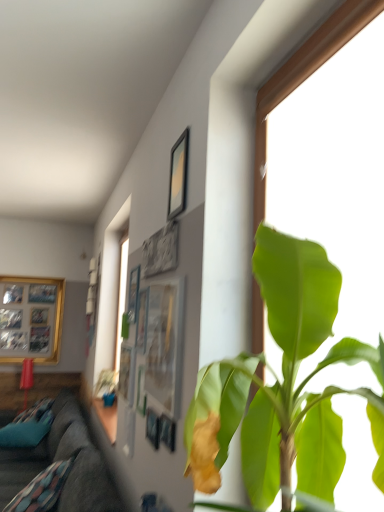
Measure the distance between point (26, 483) and camera.

Point (26, 483) and camera are 3.16 meters apart from each other.

Find the location of a particular element. dark gray fabric couch at lower left is located at coordinates (68, 458).

This screenshot has height=512, width=384. Identify the location of matte glass picture frame at center, marked as the 5th picture frame in a back-to-front arrangement. pyautogui.click(x=165, y=343).

The height and width of the screenshot is (512, 384). Find the location of `dark gray fabric couch at lower left`. dark gray fabric couch at lower left is located at coordinates (68, 458).

Does green leafy plant at center have a lesser height compared to metallic silver picture frame at upper center, which is counted as the 4th picture frame, starting from the right?

No, green leafy plant at center is not shorter than metallic silver picture frame at upper center, which is counted as the 4th picture frame, starting from the right.

Measure the distance from green leafy plant at center to metallic silver picture frame at upper center, which is the 2th picture frame in left-to-right order.

green leafy plant at center is 1.53 meters away from metallic silver picture frame at upper center, which is the 2th picture frame in left-to-right order.

From the image's perspective, which is below, green leafy plant at center or metallic silver picture frame at upper center, which is the 2th picture frame in left-to-right order?

metallic silver picture frame at upper center, which is the 2th picture frame in left-to-right order.

Is metallic silver picture frame at upper center, which is the 2th picture frame in left-to-right order, completely or partially inside green leafy plant at center?

No, metallic silver picture frame at upper center, which is the 2th picture frame in left-to-right order, is not inside green leafy plant at center.

Is matte black picture frame at upper center, which is counted as the fifth picture frame, starting from the left, bigger or smaller than dark gray fabric couch at lower left?

In the image, matte black picture frame at upper center, which is counted as the fifth picture frame, starting from the left, appears to be smaller than dark gray fabric couch at lower left.

From a real-world perspective, is matte black picture frame at upper center, marked as the fourth picture frame in a back-to-front arrangement, below dark gray fabric couch at lower left?

No.

Which object is thinner, matte black picture frame at upper center, which is counted as the second picture frame, starting from the front, or dark gray fabric couch at lower left?

Thinner between the two is matte black picture frame at upper center, which is counted as the second picture frame, starting from the front.

Which is closer to the camera, (178, 186) or (2, 465)?

Point (178, 186) appears to be closer to the viewer than point (2, 465).

In order to click on studio couch on the right of wooden photo frame at left, which is the 1th picture frame in back-to-front order in this screenshot , I will do `click(68, 458)`.

Does point (67, 392) lie behind point (42, 358)?

No, (67, 392) is in front of (42, 358).

Is dark gray fabric couch at lower left directly adjacent to wooden photo frame at left, the 1th picture frame viewed from the left?

dark gray fabric couch at lower left and wooden photo frame at left, the 1th picture frame viewed from the left, are not in contact.

Which is more to the left, matte black picture frame at upper center, which is counted as the second picture frame, starting from the front, or metallic silver picture frame at upper center, which is counted as the 4th picture frame, starting from the right?

metallic silver picture frame at upper center, which is counted as the 4th picture frame, starting from the right.

At what (x,y) coordinates should I click in order to perform the action: click on picture frame that is the 3rd object to the left of the matte black picture frame at upper center, which is counted as the fifth picture frame, starting from the left, starting at the anchor. Please return your answer as a coordinate pair (x, y). Image resolution: width=384 pixels, height=512 pixels. Looking at the image, I should click on (133, 293).

Is matte black picture frame at upper center, which is counted as the fifth picture frame, starting from the left, oriented away from metallic silver picture frame at upper center, which is counted as the 2th picture frame, starting from the back?

No, metallic silver picture frame at upper center, which is counted as the 2th picture frame, starting from the back, is not at the back of matte black picture frame at upper center, which is counted as the fifth picture frame, starting from the left.

Is metallic silver picture frame at upper center, which is counted as the 2th picture frame, starting from the back, inside or outside of matte glass picture frame at center, marked as the 5th picture frame in a back-to-front arrangement?

metallic silver picture frame at upper center, which is counted as the 2th picture frame, starting from the back, is not enclosed by matte glass picture frame at center, marked as the 5th picture frame in a back-to-front arrangement.

Considering the relative sizes of metallic silver picture frame at upper center, which is the 2th picture frame in left-to-right order, and matte glass picture frame at center, the fourth picture frame when ordered from left to right, in the image provided, is metallic silver picture frame at upper center, which is the 2th picture frame in left-to-right order, smaller than matte glass picture frame at center, the fourth picture frame when ordered from left to right,?

Correct, metallic silver picture frame at upper center, which is the 2th picture frame in left-to-right order, occupies less space than matte glass picture frame at center, the fourth picture frame when ordered from left to right.

From the picture: Is metallic silver picture frame at upper center, which is counted as the fourth picture frame, starting from the front, wider or thinner than matte glass picture frame at center, the fourth picture frame when ordered from left to right?

In the image, metallic silver picture frame at upper center, which is counted as the fourth picture frame, starting from the front, appears to be more narrow than matte glass picture frame at center, the fourth picture frame when ordered from left to right.

Is metallic silver picture frame at upper center, which is counted as the 4th picture frame, starting from the right, positioned far away from matte glass picture frame at center, the fourth picture frame when ordered from left to right?

No, metallic silver picture frame at upper center, which is counted as the 4th picture frame, starting from the right, is not far from matte glass picture frame at center, the fourth picture frame when ordered from left to right.

Which of these two, wooden photo frame at left, which ranks as the fifth picture frame in right-to-left order, or matte glass picture frame at center, marked as the 5th picture frame in a back-to-front arrangement, is wider?

wooden photo frame at left, which ranks as the fifth picture frame in right-to-left order, is wider.

From the image's perspective, is wooden photo frame at left, which ranks as the fifth picture frame in right-to-left order, located beneath matte glass picture frame at center, positioned as the 1th picture frame in front-to-back order?

Yes, from the image's perspective, wooden photo frame at left, which ranks as the fifth picture frame in right-to-left order, is below matte glass picture frame at center, positioned as the 1th picture frame in front-to-back order.

Does wooden photo frame at left, which ranks as the fifth picture frame in right-to-left order, have a smaller size compared to matte glass picture frame at center, the 2th picture frame from the right?

Actually, wooden photo frame at left, which ranks as the fifth picture frame in right-to-left order, might be larger than matte glass picture frame at center, the 2th picture frame from the right.

Considering the positions of point (0, 282) and point (164, 345), is point (0, 282) closer or farther from the camera than point (164, 345)?

Point (0, 282) is farther from the camera than point (164, 345).

Is matte black picture frame at upper center, which ranks as the 3th picture frame in front-to-back order, smaller than wooden photo frame at left, which is the 1th picture frame in back-to-front order?

Yes, matte black picture frame at upper center, which ranks as the 3th picture frame in front-to-back order, is smaller than wooden photo frame at left, which is the 1th picture frame in back-to-front order.

Is matte black picture frame at upper center, acting as the third picture frame starting from the right, with wooden photo frame at left, which is the 1th picture frame in back-to-front order?

matte black picture frame at upper center, acting as the third picture frame starting from the right, is not next to wooden photo frame at left, which is the 1th picture frame in back-to-front order, and they're not touching.

From a real-world perspective, is matte black picture frame at upper center, which appears as the third picture frame when viewed from the back, located higher than wooden photo frame at left, which is the 1th picture frame in back-to-front order?

Indeed, from a real-world perspective, matte black picture frame at upper center, which appears as the third picture frame when viewed from the back, stands above wooden photo frame at left, which is the 1th picture frame in back-to-front order.

Could you measure the distance between matte black picture frame at upper center, which appears as the third picture frame when viewed from the back, and wooden photo frame at left, which appears as the 5th picture frame when viewed from the front?

matte black picture frame at upper center, which appears as the third picture frame when viewed from the back, and wooden photo frame at left, which appears as the 5th picture frame when viewed from the front, are 3.80 meters apart from each other.

From the image's perspective, count 1st picture frames downward from the green leafy plant at center and point to it. Please provide its 2D coordinates.

[(133, 293)]

Find the location of `studio couch behind the matte black picture frame at upper center, which is counted as the fifth picture frame, starting from the left`. studio couch behind the matte black picture frame at upper center, which is counted as the fifth picture frame, starting from the left is located at coordinates (68, 458).

Looking at the image, which one is located closer to metallic silver picture frame at upper center, which is counted as the 4th picture frame, starting from the right, wooden photo frame at left, the 1th picture frame viewed from the left, or green leafy plant at center?

Among the two, green leafy plant at center is located nearer to metallic silver picture frame at upper center, which is counted as the 4th picture frame, starting from the right.

When comparing their distances from dark gray fabric couch at lower left, does matte black picture frame at upper center, which appears as the third picture frame when viewed from the back, or wooden photo frame at left, which appears as the 5th picture frame when viewed from the front, seem further?

Among the two, wooden photo frame at left, which appears as the 5th picture frame when viewed from the front, is located further to dark gray fabric couch at lower left.

Which object lies further to the anchor point matte glass picture frame at center, marked as the 5th picture frame in a back-to-front arrangement, matte black picture frame at upper center, which ranks as the 3th picture frame in front-to-back order, or metallic silver picture frame at upper center, which is counted as the fourth picture frame, starting from the front?

metallic silver picture frame at upper center, which is counted as the fourth picture frame, starting from the front, is positioned further to the anchor matte glass picture frame at center, marked as the 5th picture frame in a back-to-front arrangement.

Which object lies nearer to the anchor point wooden photo frame at left, which ranks as the fifth picture frame in right-to-left order, metallic silver picture frame at upper center, which is counted as the 2th picture frame, starting from the back, or green leafy plant at center?

Among the two, metallic silver picture frame at upper center, which is counted as the 2th picture frame, starting from the back, is located nearer to wooden photo frame at left, which ranks as the fifth picture frame in right-to-left order.

When comparing their distances from matte black picture frame at upper center, which appears as the third picture frame when viewed from the back, does green leafy plant at center or wooden photo frame at left, which is the 1th picture frame in back-to-front order, seem further?

wooden photo frame at left, which is the 1th picture frame in back-to-front order, is further to matte black picture frame at upper center, which appears as the third picture frame when viewed from the back.

From the image, which object appears to be nearer to matte black picture frame at upper center, marked as the fourth picture frame in a back-to-front arrangement, metallic silver picture frame at upper center, which is the 2th picture frame in left-to-right order, or dark gray fabric couch at lower left?

metallic silver picture frame at upper center, which is the 2th picture frame in left-to-right order, lies closer to matte black picture frame at upper center, marked as the fourth picture frame in a back-to-front arrangement, than the other object.

Based on their spatial positions, is matte glass picture frame at center, marked as the 5th picture frame in a back-to-front arrangement, or green leafy plant at center further from matte black picture frame at upper center, acting as the third picture frame starting from the right?

green leafy plant at center is further to matte black picture frame at upper center, acting as the third picture frame starting from the right.

From the image, which object appears to be farther from matte black picture frame at upper center, which appears as the third picture frame when viewed from the back, metallic silver picture frame at upper center, which is counted as the 2th picture frame, starting from the back, or wooden photo frame at left, the 1th picture frame viewed from the left?

Based on the image, wooden photo frame at left, the 1th picture frame viewed from the left, appears to be further to matte black picture frame at upper center, which appears as the third picture frame when viewed from the back.

Where is `studio couch between matte glass picture frame at center, the fourth picture frame when ordered from left to right, and wooden photo frame at left, the 1th picture frame viewed from the left, along the z-axis`? studio couch between matte glass picture frame at center, the fourth picture frame when ordered from left to right, and wooden photo frame at left, the 1th picture frame viewed from the left, along the z-axis is located at coordinates (68, 458).

Where is `studio couch between metallic silver picture frame at upper center, which is counted as the 4th picture frame, starting from the right, and wooden photo frame at left, which appears as the 5th picture frame when viewed from the front, from front to back`? The height and width of the screenshot is (512, 384). studio couch between metallic silver picture frame at upper center, which is counted as the 4th picture frame, starting from the right, and wooden photo frame at left, which appears as the 5th picture frame when viewed from the front, from front to back is located at coordinates (68, 458).

Identify the location of picture frame positioned between matte black picture frame at upper center, acting as the third picture frame starting from the right, and wooden photo frame at left, which is the 1th picture frame in back-to-front order, from near to far. This screenshot has height=512, width=384. (133, 293).

In order to click on picture frame located between green leafy plant at center and matte black picture frame at upper center, which is counted as the fifth picture frame, starting from the left, in the depth direction in this screenshot , I will do `click(165, 343)`.